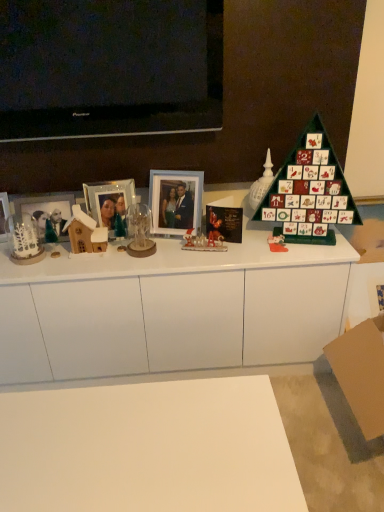
Find the location of a particular element. This screenshot has width=384, height=512. free location in front of white glossy santa claus at center, marked as the fourth toy in a left-to-right arrangement is located at coordinates (203, 260).